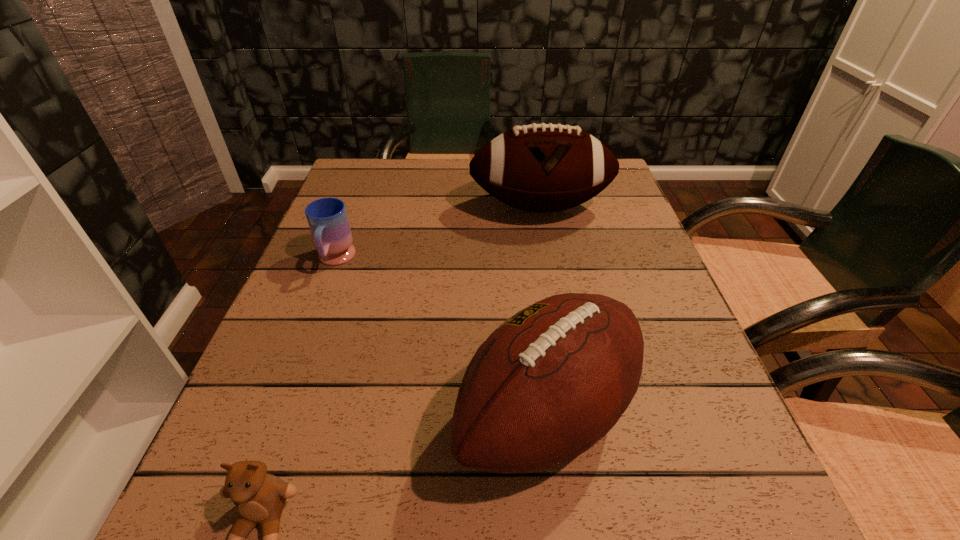
Where is `object located in the near right corner section of the desktop`? object located in the near right corner section of the desktop is located at coordinates (551, 381).

The image size is (960, 540). I want to click on vacant space at the far edge of the desktop, so click(x=454, y=181).

Find the location of `vacant area at the near edge of the desktop`. vacant area at the near edge of the desktop is located at coordinates (584, 495).

The height and width of the screenshot is (540, 960). I want to click on vacant region at the left edge of the desktop, so (x=278, y=320).

This screenshot has height=540, width=960. Identify the location of vacant space at the right edge of the desktop. (716, 403).

Identify the location of free space at the far left corner. The height and width of the screenshot is (540, 960). (360, 180).

This screenshot has height=540, width=960. In the image, there is a desktop. Find the location of `blank space at the near right corner`. blank space at the near right corner is located at coordinates (700, 539).

You are a GUI agent. You are given a task and a screenshot of the screen. Output one action in this format:
    pyautogui.click(x=<x>, y=<y>)
    Task: Click on the unoccupied position between the nearer football (American) and the third nearest object
    
    Given the screenshot: What is the action you would take?
    point(441,338)

This screenshot has height=540, width=960. I want to click on free area in between the farther football (American) and the mug, so click(x=438, y=234).

You are a GUI agent. You are given a task and a screenshot of the screen. Output one action in this format:
    pyautogui.click(x=<x>, y=<y>)
    Task: Click on the vacant space that is in between the farthest object and the mug
    This screenshot has height=540, width=960.
    Given the screenshot: What is the action you would take?
    pyautogui.click(x=438, y=234)